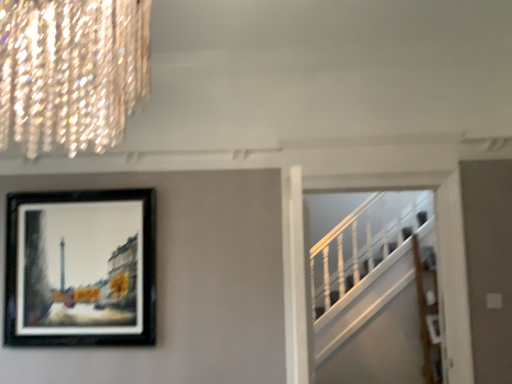
Question: From the image's perspective, is white wooden stairs at right above or below crystal glass chandelier at upper left?

Choices:
 (A) below
 (B) above

Answer: (A)

Question: From a real-world perspective, is white wooden stairs at right positioned above or below crystal glass chandelier at upper left?

Choices:
 (A) above
 (B) below

Answer: (B)

Question: Estimate the real-world distances between objects in this image. Which object is farther from the black matte picture frame at upper left?

Choices:
 (A) crystal glass chandelier at upper left
 (B) white wooden stairs at right

Answer: (B)

Question: Estimate the real-world distances between objects in this image. Which object is closer to the white wooden stairs at right?

Choices:
 (A) crystal glass chandelier at upper left
 (B) black matte picture frame at upper left

Answer: (B)